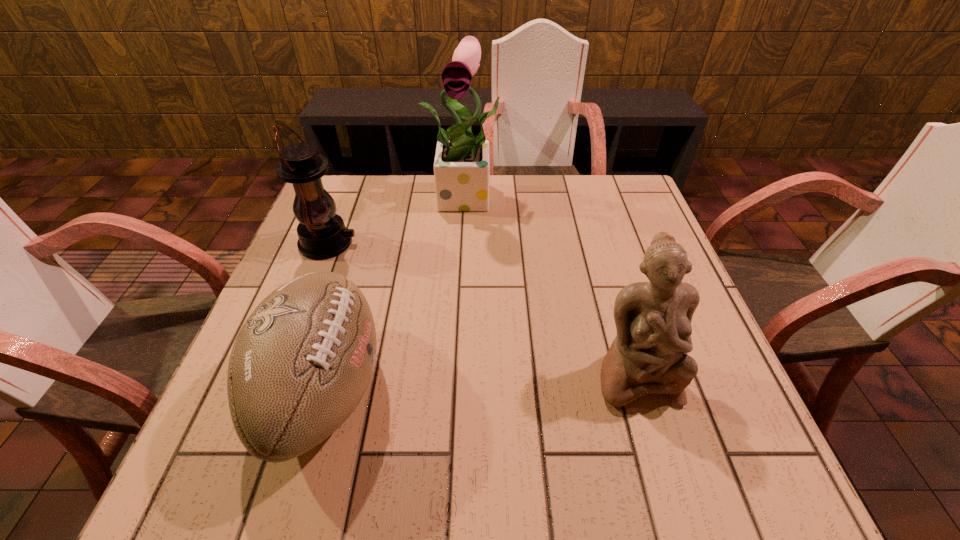
You are a GUI agent. You are given a task and a screenshot of the screen. Output one action in this format:
    pyautogui.click(x=<x>, y=<y>)
    Task: Click on the flower arrangement
    The image size is (960, 540).
    Given the screenshot: What is the action you would take?
    pyautogui.click(x=461, y=167)

At what (x,y) coordinates should I click in order to perform the action: click on the farthest object. Please return your answer as a coordinate pair (x, y). Image resolution: width=960 pixels, height=540 pixels. Looking at the image, I should click on (461, 167).

Image resolution: width=960 pixels, height=540 pixels. In order to click on the second farthest object in this screenshot , I will do `click(322, 234)`.

Where is `the rightmost object`? The width and height of the screenshot is (960, 540). the rightmost object is located at coordinates (653, 319).

Locate an element on the screen. football (American) is located at coordinates (303, 360).

Find the location of a particular element. This screenshot has width=960, height=540. vacant point located on the front-facing side of the flower arrangement is located at coordinates (467, 270).

Locate several points within the vacant space situated above the third nearest object, indicating its light source. Please provide its 2D coordinates. Your answer should be formatted as a tuple, i.e. [(x, y)], where the tuple contains the x and y coordinates of a point satisfying the conditions above.

[(447, 243)]

Where is `free space located on the front-facing side of the rightmost object`? The width and height of the screenshot is (960, 540). free space located on the front-facing side of the rightmost object is located at coordinates (664, 473).

The image size is (960, 540). Identify the location of vacant region located 0.150m on the laces of the football (American). (466, 390).

This screenshot has height=540, width=960. I want to click on object positioned at the far edge, so click(461, 167).